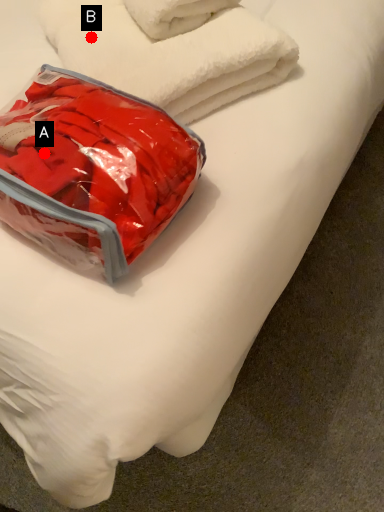
Question: Two points are circled on the image, labeled by A and B beside each circle. Which point is farther to the camera?

Choices:
 (A) A is further
 (B) B is further

Answer: (B)